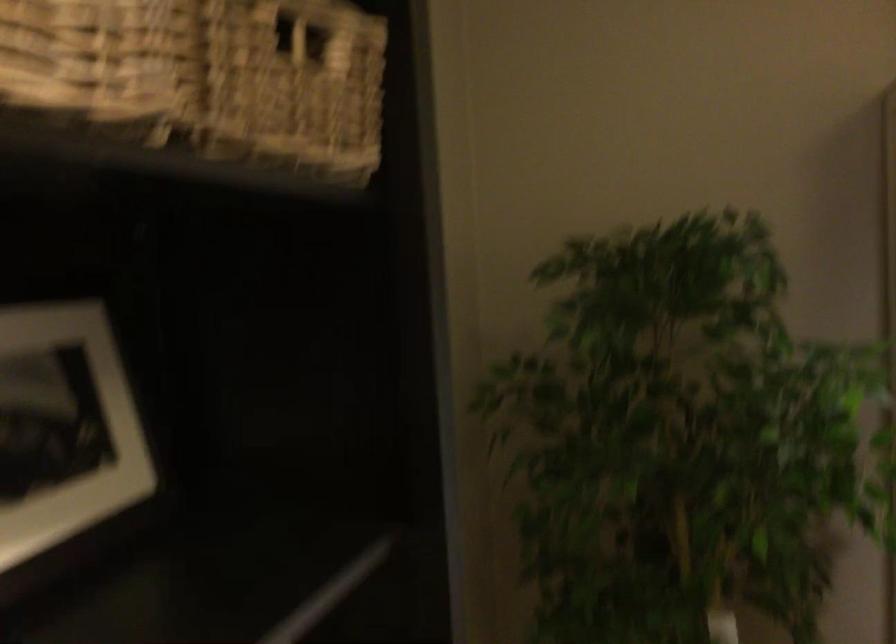
In order to click on white picture frame in this screenshot , I will do `click(64, 427)`.